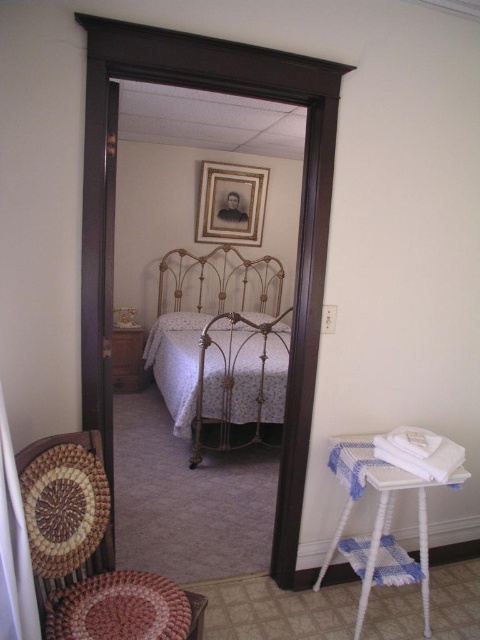
Between point (55, 560) and point (460, 460), which one is positioned in front?

Point (55, 560) is more forward.

I want to click on braided wood chair at lower left, so click(90, 552).

Does gold-toned metal bed frame at center appear on the left side of braided wood chair at lower left?

Yes, gold-toned metal bed frame at center is to the left of braided wood chair at lower left.

Which is in front, point (119, 163) or point (24, 483)?

Point (24, 483)

What do you see at coordinates (194, 212) in the screenshot? This screenshot has height=640, width=480. I see `gold-toned metal bed frame at center` at bounding box center [194, 212].

This screenshot has height=640, width=480. In order to click on gold-toned metal bed frame at center in this screenshot , I will do [194, 212].

Between point (267, 396) and point (242, 180), which one is positioned in front?

Point (267, 396) is more forward.

Who is more distant from viewer, (275,268) or (228,170)?

The point (275,268) is behind.

Find the location of a particular element. This screenshot has height=640, width=480. gold-toned metal bed frame at center is located at coordinates (194, 212).

Identify the location of gold-toned metal bed frame at center. The height and width of the screenshot is (640, 480). (194, 212).